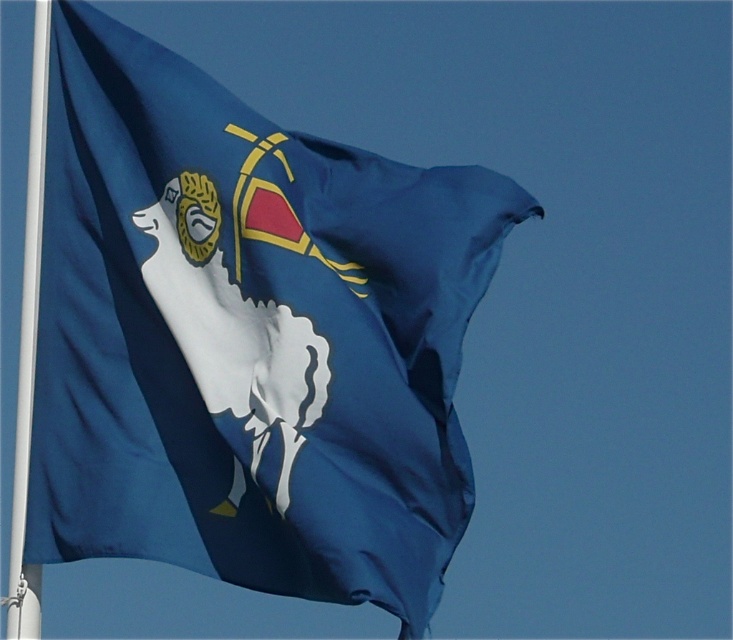
You are a painter standing at the base of the white plastic pole at left and want to paint the blue silk flag at center. If your longest brush is 20 feet long, can you reach the flag with the brush?

The blue silk flag at center and white plastic pole at left are 23.35 feet apart from each other. Since the longest brush is only 20 feet long, the painter cannot reach the flag with the brush.

You are a photographer trying to capture the blue silk flag at center and the white plastic pole at left in a single frame. Based on their sizes, which object will appear larger in the photo?

The white plastic pole at left appears larger in the photo because the blue silk flag at center has a smaller size compared to it.